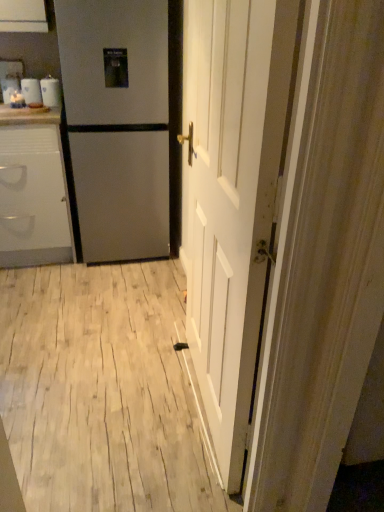
The height and width of the screenshot is (512, 384). I want to click on free space in front of white glossy cabinet at left, so click(x=41, y=292).